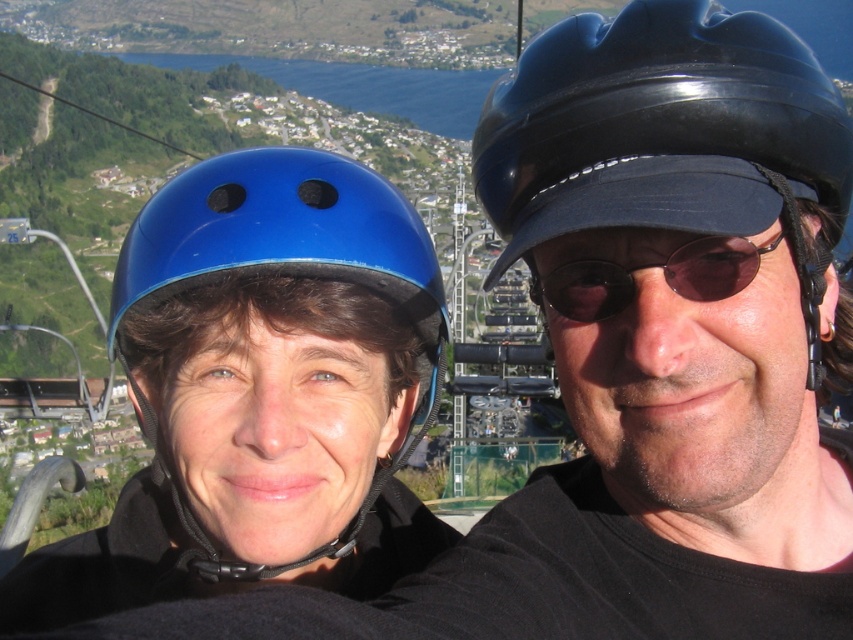
You are a photographer trying to capture a clear shot of the black glossy helmet at upper center and the sunglasses at center. Based on their positions, which object should you focus on first to ensure both are in frame without moving the camera?

A: The black glossy helmet at upper center is located above the sunglasses at center, so you should focus on the sunglasses at center first to ensure both are in frame without moving the camera.

You are a photographer trying to capture both the black glossy helmet at upper center and the blue matte helmet at left in a single shot. Based on their positions, which helmet will appear larger in your photo?

The black glossy helmet at upper center appears larger in the photo because it is closer to the viewer than the blue matte helmet at left.